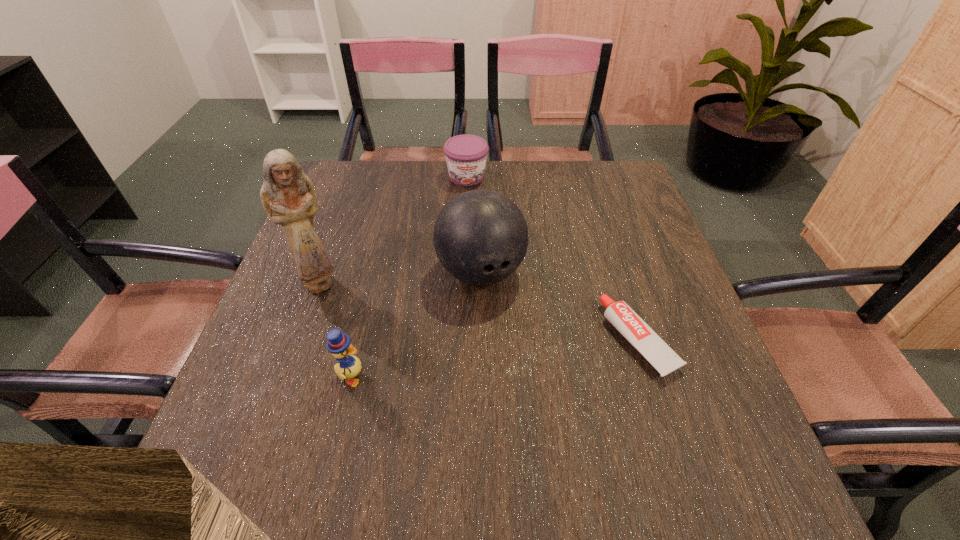
The width and height of the screenshot is (960, 540). Find the location of `vacant space in between the leftmost object and the bowling ball`. vacant space in between the leftmost object and the bowling ball is located at coordinates (399, 278).

Locate an element on the screen. The width and height of the screenshot is (960, 540). vacant space that is in between the second object from left to right and the fourth shortest object is located at coordinates (416, 325).

Locate an element on the screen. The height and width of the screenshot is (540, 960). free space between the rightmost object and the fourth shortest object is located at coordinates (560, 306).

Locate an element on the screen. vacant space that is in between the farthest object and the duckling is located at coordinates (409, 277).

Identify the location of unoccupied position between the bowling ball and the figurine. This screenshot has width=960, height=540. (399, 278).

Image resolution: width=960 pixels, height=540 pixels. Identify the location of free spot between the second tallest object and the figurine. (399, 278).

Locate an element on the screen. Image resolution: width=960 pixels, height=540 pixels. free space between the toothpaste and the bowling ball is located at coordinates click(x=560, y=306).

The width and height of the screenshot is (960, 540). I want to click on unoccupied area between the second object from left to right and the farthest object, so click(409, 277).

Locate an element on the screen. free area in between the jam and the toothpaste is located at coordinates (553, 258).

Select which object is the closest to the fourth tallest object. Please provide its 2D coordinates. Your answer should be formatted as a tuple, i.e. [(x, y)], where the tuple contains the x and y coordinates of a point satisfying the conditions above.

[(481, 237)]